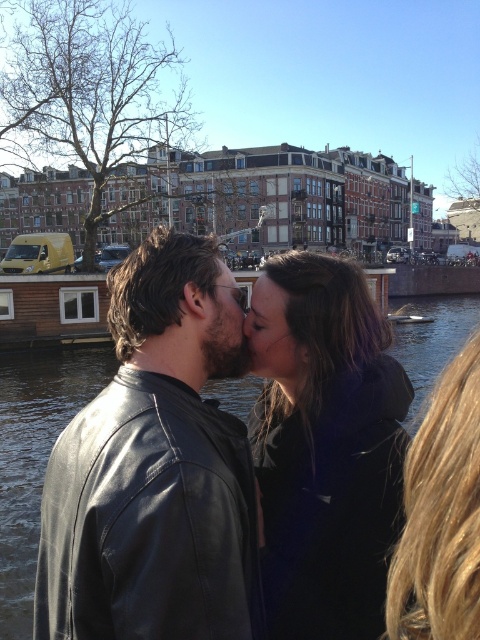
You are a photographer trying to capture the scene of the two individuals kissing by the canal. You want to ensure the dark brown leather jacket at center is in focus. Based on its position, where should you aim your camera lens?

The dark brown leather jacket at center is located at point (326, 451), so you should aim your camera lens at that coordinate to ensure it is in focus.

You are a photographer trying to capture a closeup of the couple kissing by the canal. You want to focus on the point closer to you. Which point should you focus on, point (33, 532) or point (276, 285)?

You should focus on point (33, 532) because it is further to the camera than point (276, 285).

You are a photographer standing at a safe distance. You want to capture a closeup shot of the black leather jacket at center without disturbing the subjects. Given that your camera has a maximum zoom range of 100 feet, can you achieve this?

The black leather jacket at center is 98.72 feet away from the viewer. Since your camera can zoom up to 100 feet, you can capture a closeup shot of the black leather jacket at center without needing to move closer.